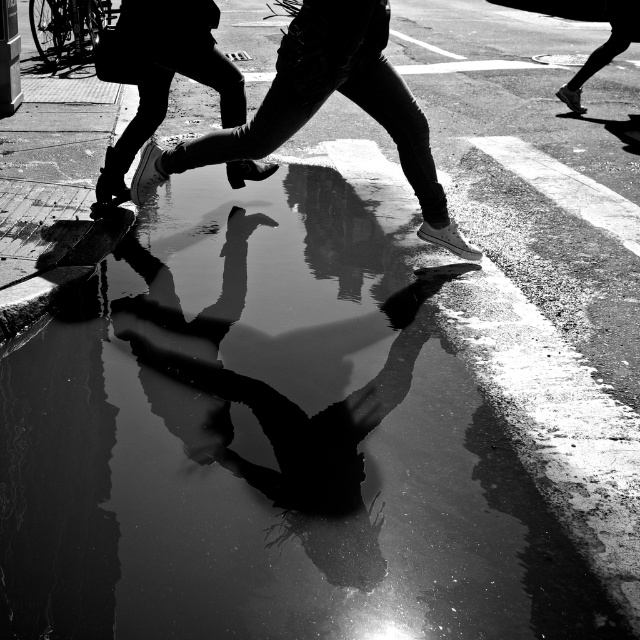
You are a delivery person who needs to place a smooth leather shoe at center and a white leather shoe at upper left into a shoebox. The shoebox can only hold items within a 20 inch length. Can both shoes fit in the shoebox together?

The smooth leather shoe at center is 22.96 inches away from the white leather shoe at upper left, which means the combined length of both shoes exceeds the shoebox capacity. Therefore, they cannot fit together.

You are a photographer analyzing the urban scene. You notice the smooth leather shoe at center and the white leather shoe at upper left. Which shoe occupies a larger area in the image?

The smooth leather shoe at center has a greater width than the white leather shoe at upper left, so it occupies a larger area in the image.